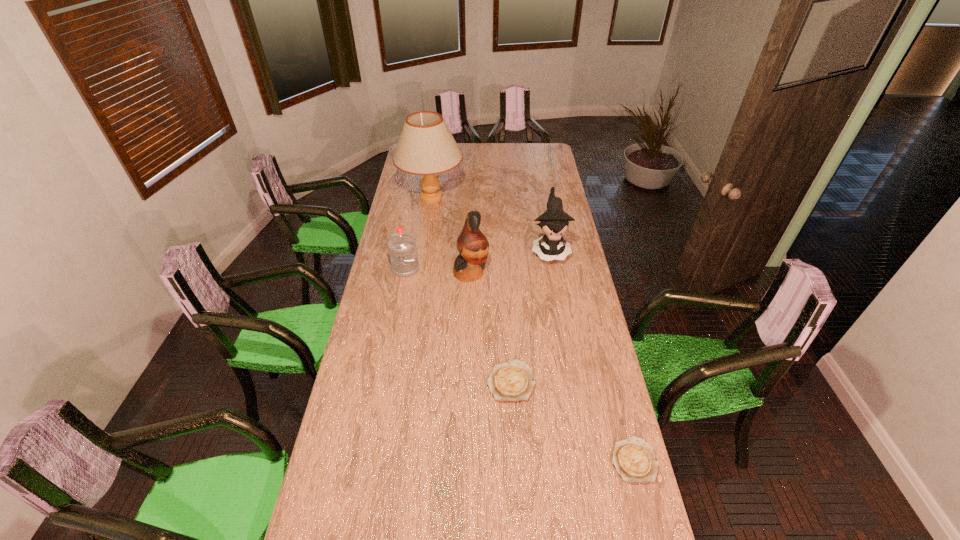
Where is `object located at the near right corner`? Image resolution: width=960 pixels, height=540 pixels. object located at the near right corner is located at coordinates (634, 459).

This screenshot has height=540, width=960. I want to click on vacant space at the far edge of the desktop, so click(x=487, y=159).

Find the location of a particular element. This screenshot has height=540, width=960. free spot at the near edge of the desktop is located at coordinates (539, 500).

The height and width of the screenshot is (540, 960). What are the coordinates of `vacant space at the left edge of the desktop` in the screenshot? It's located at (402, 197).

This screenshot has width=960, height=540. Find the location of `vacant space at the right edge of the desktop`. vacant space at the right edge of the desktop is located at coordinates (574, 239).

The image size is (960, 540). In order to click on vacant space that is in between the taller quiche and the water bottle in this screenshot , I will do `click(458, 325)`.

The image size is (960, 540). Find the location of `unoccupied position between the nearer quiche and the third tallest object`. unoccupied position between the nearer quiche and the third tallest object is located at coordinates pyautogui.click(x=591, y=355).

At what (x,y) coordinates should I click in order to perform the action: click on free area in between the second nearest object and the nearer quiche. Please return your answer as a coordinate pair (x, y). Looking at the image, I should click on (572, 421).

This screenshot has height=540, width=960. I want to click on unoccupied area between the fifth shortest object and the right quiche, so click(552, 366).

The height and width of the screenshot is (540, 960). Find the location of `vacant area that lies between the doll and the farther quiche`. vacant area that lies between the doll and the farther quiche is located at coordinates (530, 315).